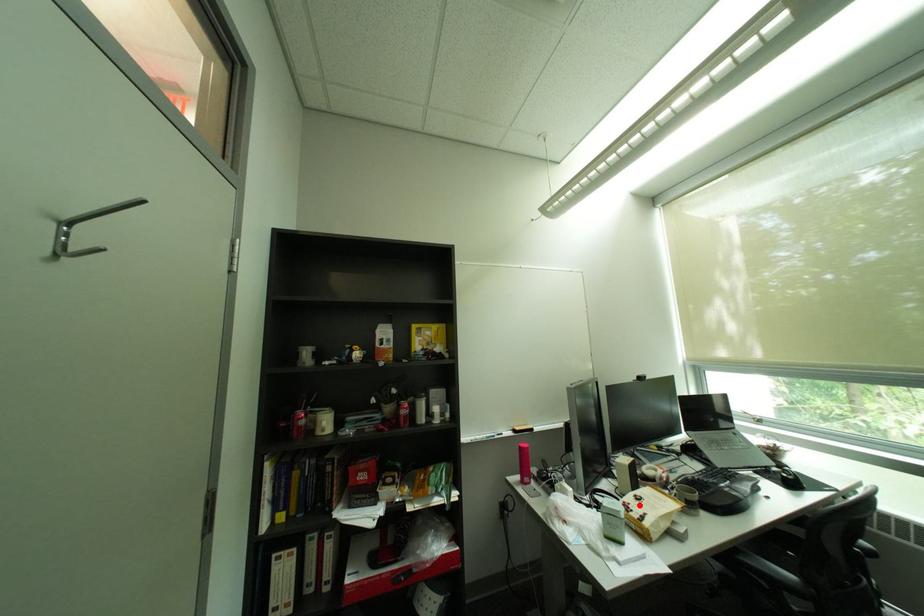
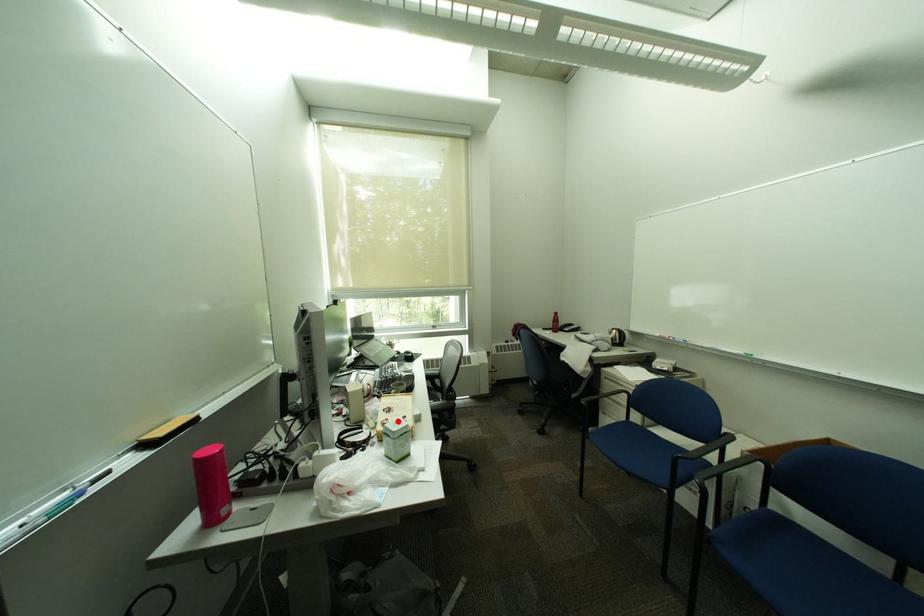
From the picture: I am providing you with two images of the same scene from different viewpoints. A red point is marked on the first image and another point is marked on the second image. Is the red point in image1 aligned with the point shown in image2?

Yes